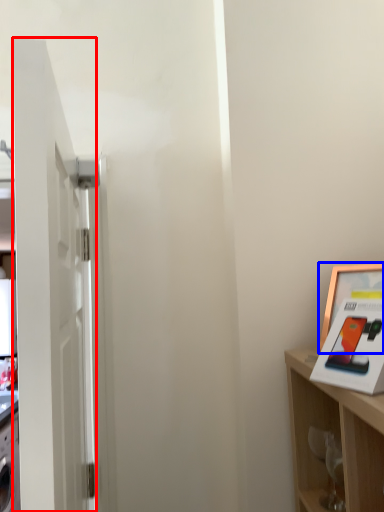
Question: Among these objects, which one is nearest to the camera, door (highlighted by a red box) or picture frame (highlighted by a blue box)?

Choices:
 (A) door
 (B) picture frame

Answer: (A)